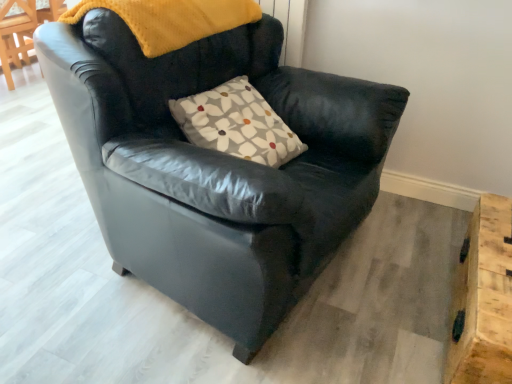
What is the approximate height of floral-patterned fabric pillow at center?

11.57 inches.

At what (x,y) coordinates should I click in order to perform the action: click on black leather armchair at center. Please return your answer as a coordinate pair (x, y). This screenshot has width=512, height=384. Looking at the image, I should click on (216, 166).

Is black leather armchair at center not near floral-patterned fabric pillow at center?

They are positioned close to each other.

Which of these two, black leather armchair at center or floral-patterned fabric pillow at center, is wider?

black leather armchair at center is wider.

From a real-world perspective, does black leather armchair at center stand above floral-patterned fabric pillow at center?

No, from a real-world perspective, black leather armchair at center is not over floral-patterned fabric pillow at center

Looking at this image, could you tell me if black leather armchair at center is turned towards floral-patterned fabric pillow at center?

Yes, black leather armchair at center is facing floral-patterned fabric pillow at center.

Can you tell me how much black leather armchair at center and wooden at lower right differ in facing direction?

The angular difference between black leather armchair at center and wooden at lower right is 79.7 degrees.

From a real-world perspective, which is physically above, black leather armchair at center or wooden at lower right?

From a 3D spatial view, black leather armchair at center is above.

Could you tell me if black leather armchair at center is facing wooden at lower right?

Yes, black leather armchair at center is turned towards wooden at lower right.

Does wooden at lower right have a lesser width compared to floral-patterned fabric pillow at center?

No, wooden at lower right is not thinner than floral-patterned fabric pillow at center.

Which object is closer to the camera taking this photo, wooden at lower right or floral-patterned fabric pillow at center?

wooden at lower right.

The height and width of the screenshot is (384, 512). Identify the location of pillow behind the wooden at lower right. (237, 124).

Is wooden at lower right turned away from floral-patterned fabric pillow at center?

No, wooden at lower right is not facing the opposite direction of floral-patterned fabric pillow at center.

Which object is positioned more to the right, floral-patterned fabric pillow at center or wooden at lower right?

From the viewer's perspective, wooden at lower right appears more on the right side.

Consider the image. In the image, is floral-patterned fabric pillow at center positioned in front of or behind wooden at lower right?

In the image, floral-patterned fabric pillow at center appears behind wooden at lower right.

Is floral-patterned fabric pillow at center wider than wooden at lower right?

No.

Is wooden at lower right positioned with its back to black leather armchair at center?

wooden at lower right is not turned away from black leather armchair at center.

From a real-world perspective, which object rests below the other?

From a 3D spatial view, wooden at lower right is below.

Looking at this image, is wooden at lower right located outside black leather armchair at center?

wooden at lower right is positioned outside black leather armchair at center.

Is wooden at lower right at the right side of black leather armchair at center?

Indeed, wooden at lower right is positioned on the right side of black leather armchair at center.

Is floral-patterned fabric pillow at center taller than black leather armchair at center?

In fact, floral-patterned fabric pillow at center may be shorter than black leather armchair at center.

Considering the relative sizes of floral-patterned fabric pillow at center and black leather armchair at center in the image provided, is floral-patterned fabric pillow at center wider than black leather armchair at center?

Incorrect, the width of floral-patterned fabric pillow at center does not surpass that of black leather armchair at center.

Would you say floral-patterned fabric pillow at center is a long distance from black leather armchair at center?

No, floral-patterned fabric pillow at center is not far from black leather armchair at center.

From the image's perspective, which object appears higher, floral-patterned fabric pillow at center or black leather armchair at center?

floral-patterned fabric pillow at center, from the image's perspective.

Find the location of a particular element. The height and width of the screenshot is (384, 512). chair in front of the floral-patterned fabric pillow at center is located at coordinates (216, 166).

What are the coordinates of `chair to the left of wooden at lower right` in the screenshot? It's located at 216,166.

Which object lies nearer to the anchor point floral-patterned fabric pillow at center, black leather armchair at center or wooden at lower right?

black leather armchair at center lies closer to floral-patterned fabric pillow at center than the other object.

Which object lies further to the anchor point black leather armchair at center, wooden at lower right or floral-patterned fabric pillow at center?

wooden at lower right is further to black leather armchair at center.

When comparing their distances from wooden at lower right, does black leather armchair at center or floral-patterned fabric pillow at center seem further?

floral-patterned fabric pillow at center is positioned further to the anchor wooden at lower right.

Considering their positions, is wooden at lower right positioned further to floral-patterned fabric pillow at center than black leather armchair at center?

wooden at lower right.

When comparing their distances from black leather armchair at center, does floral-patterned fabric pillow at center or wooden at lower right seem further?

Among the two, wooden at lower right is located further to black leather armchair at center.

Considering their positions, is floral-patterned fabric pillow at center positioned further to wooden at lower right than black leather armchair at center?

The object further to wooden at lower right is floral-patterned fabric pillow at center.

This screenshot has height=384, width=512. I want to click on pillow situated between black leather armchair at center and wooden at lower right from left to right, so click(x=237, y=124).